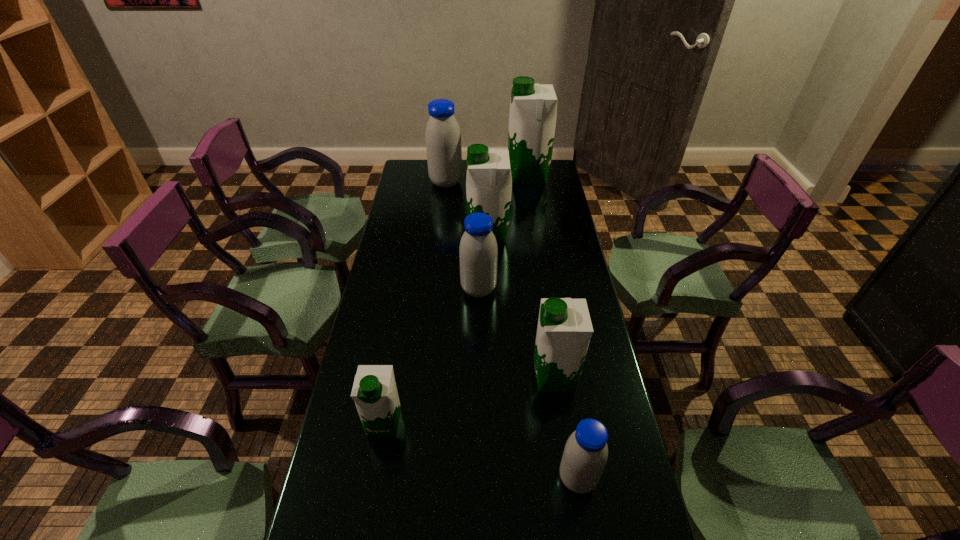
This screenshot has height=540, width=960. I want to click on free space located 0.060m on the left of the leftmost blue soya milk, so click(417, 183).

This screenshot has width=960, height=540. I want to click on vacant space located 0.120m on the front-facing side of the second smallest green soya milk, so click(x=491, y=377).

Locate an element on the screen. Image resolution: width=960 pixels, height=540 pixels. vacant point located on the front-facing side of the second smallest green soya milk is located at coordinates (408, 377).

Identify the location of vacant space located on the front-facing side of the second smallest green soya milk. (480, 377).

Locate an element on the screen. This screenshot has height=540, width=960. vacant space located on the right of the second nearest blue soya milk is located at coordinates (525, 289).

Identify the location of vacant region located on the front-facing side of the leftmost green soya milk. (374, 481).

I want to click on free region located on the left of the rightmost blue soya milk, so click(x=414, y=478).

I want to click on object positioned at the far left corner, so click(443, 137).

This screenshot has width=960, height=540. What are the coordinates of `object that is at the far right corner` in the screenshot? It's located at pyautogui.click(x=533, y=107).

Where is `free spot at the left edge of the desktop`? This screenshot has width=960, height=540. free spot at the left edge of the desktop is located at coordinates (383, 328).